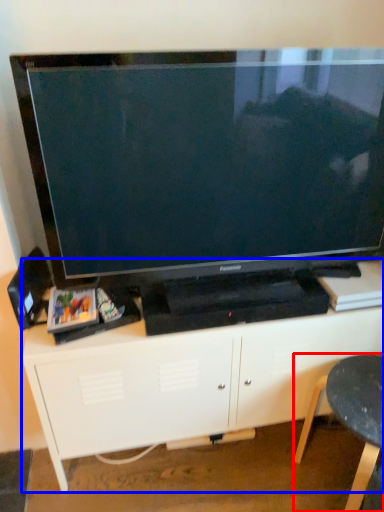
Question: Among these objects, which one is nearest to the camera, furniture (highlighted by a red box) or entertainment center (highlighted by a blue box)?

Choices:
 (A) furniture
 (B) entertainment center

Answer: (A)